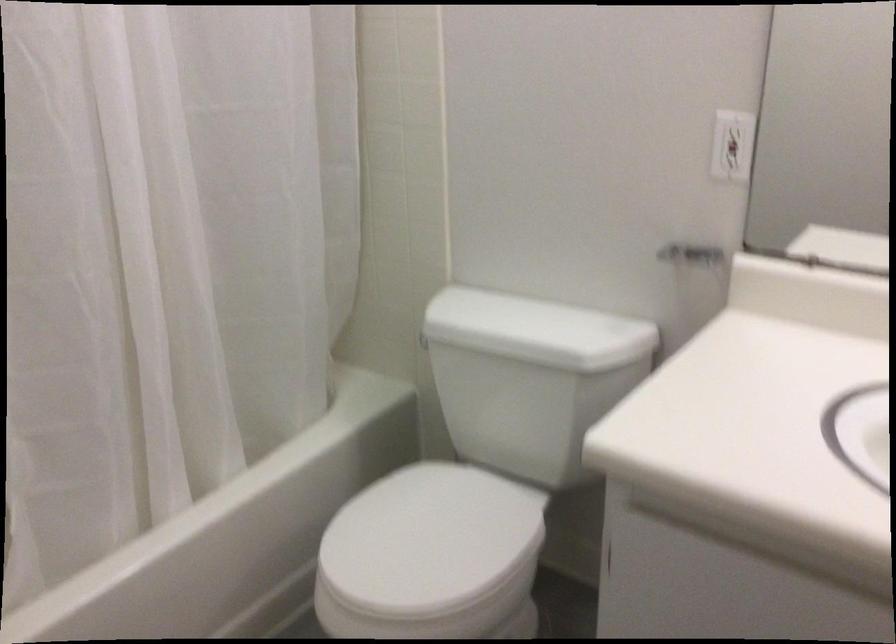
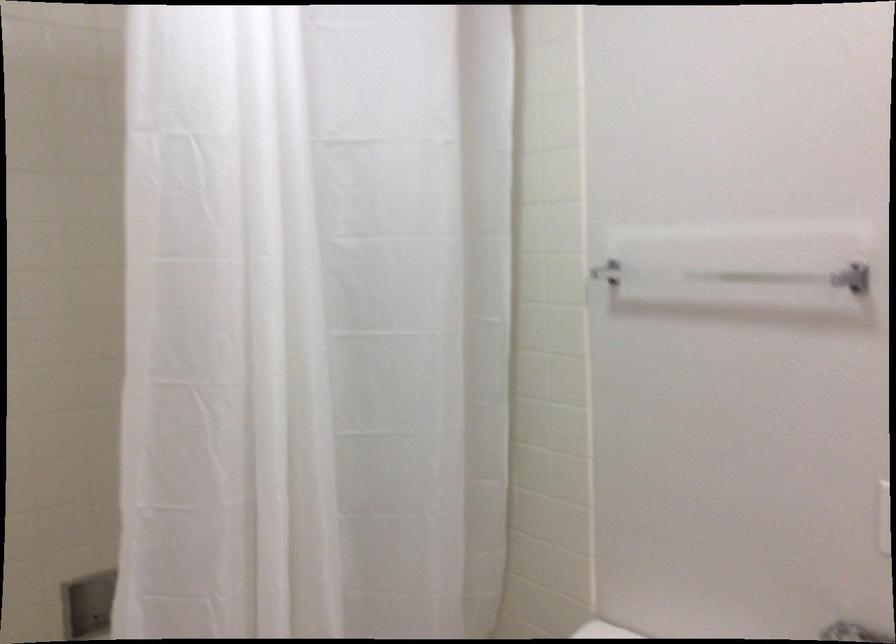
Question: The images are taken continuously from a first-person perspective. In which direction are you moving?

Choices:
 (A) Left
 (B) Right
 (C) Forward
 (D) Backward

Answer: (B)